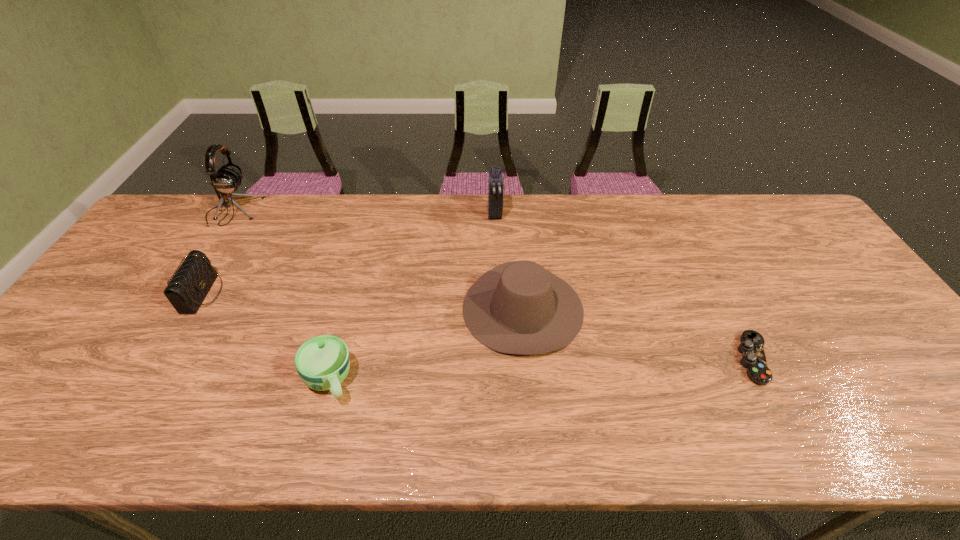
Where is `vacant space at the left edge of the desktop`? The height and width of the screenshot is (540, 960). vacant space at the left edge of the desktop is located at coordinates [x=76, y=384].

Image resolution: width=960 pixels, height=540 pixels. I want to click on vacant space at the near right corner, so click(x=916, y=415).

You are a GUI agent. You are given a task and a screenshot of the screen. Output one action in this format:
    pyautogui.click(x=<x>, y=<y>)
    Task: Click on the free space between the cowboy hat and the shorter clutch bag
    Image resolution: width=960 pixels, height=540 pixels.
    Given the screenshot: What is the action you would take?
    pyautogui.click(x=363, y=301)

You are a GUI agent. You are given a task and a screenshot of the screen. Output one action in this format:
    pyautogui.click(x=<x>, y=<y>)
    Task: Click on the vacant area between the taller clutch bag and the fourth shortest object
    
    Given the screenshot: What is the action you would take?
    pyautogui.click(x=509, y=261)

In order to click on unoccupied position between the third tallest object and the shortest object in this screenshot , I will do `click(638, 334)`.

I want to click on vacant space in between the tallest object and the cowboy hat, so pos(378,260).

Identify the location of unoccupied position between the left clutch bag and the earphone. The height and width of the screenshot is (540, 960). (218, 253).

You are a GUI agent. You are given a task and a screenshot of the screen. Output one action in this format:
    pyautogui.click(x=<x>, y=<y>)
    Task: Click on the empty space that is in between the earphone and the cowboy hat
    The image size is (960, 540).
    Given the screenshot: What is the action you would take?
    pyautogui.click(x=378, y=260)

This screenshot has height=540, width=960. I want to click on vacant space that is in between the shorter clutch bag and the cowboy hat, so click(x=363, y=301).

Select which object appears as the closest to the cup. Please provide its 2D coordinates. Your answer should be formatted as a tuple, i.e. [(x, y)], where the tuple contains the x and y coordinates of a point satisfying the conditions above.

[(519, 307)]